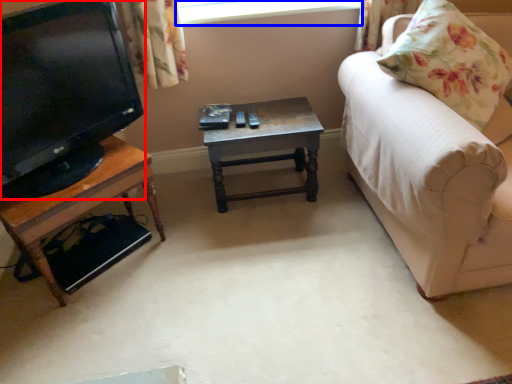
Question: Which object is further to the camera taking this photo, television (highlighted by a red box) or window screen (highlighted by a blue box)?

Choices:
 (A) television
 (B) window screen

Answer: (B)